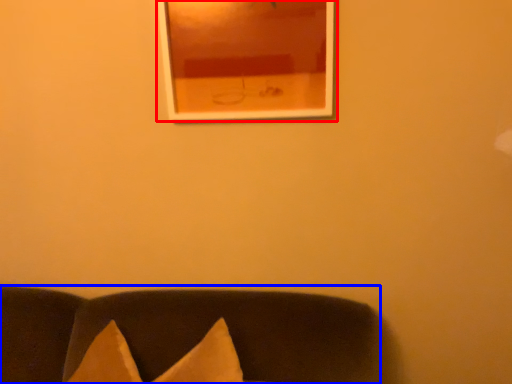
Question: Which point is further to the camera, picture frame (highlighted by a red box) or furniture (highlighted by a blue box)?

Choices:
 (A) picture frame
 (B) furniture

Answer: (A)